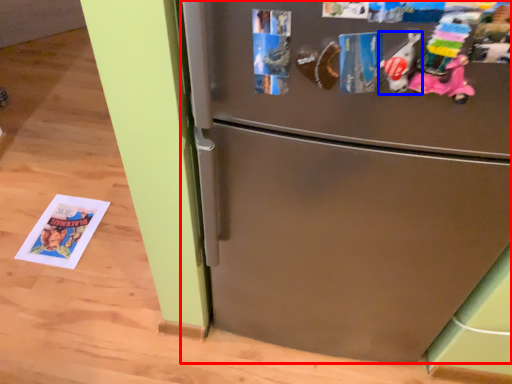
Question: Which object appears farthest to the camera in this image, refrigerator (highlighted by a red box) or toy (highlighted by a blue box)?

Choices:
 (A) refrigerator
 (B) toy

Answer: (A)